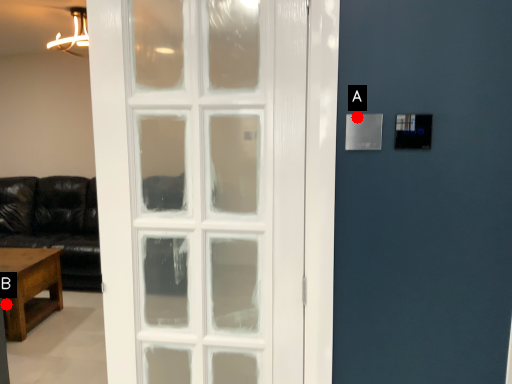
Question: Two points are circled on the image, labeled by A and B beside each circle. Among these points, which one is farthest from the camera?

Choices:
 (A) A is further
 (B) B is further

Answer: (B)